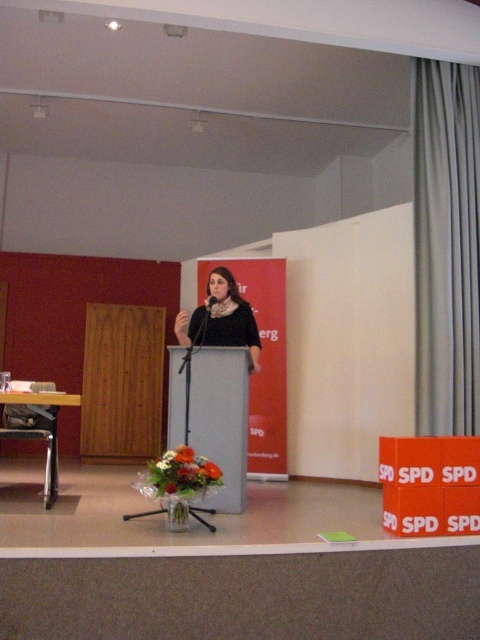
You are planning to place a new decorative item on the podium. The podium is at coordinates point 0.656, 0.460. Can you confirm the exact location of the matte gray podium at center to ensure proper placement?

Answer: The matte gray podium at center is located at coordinates point (x=220, y=419).

You are organizing an event and need to ensure that the black fabric scarf at center and the black matte microphone at center are visible to the audience. Which object should you adjust to make sure both are clearly seen?

The black fabric scarf at center is larger than the black matte microphone at center, so you should adjust the position of the black fabric scarf at center to ensure both are visible.